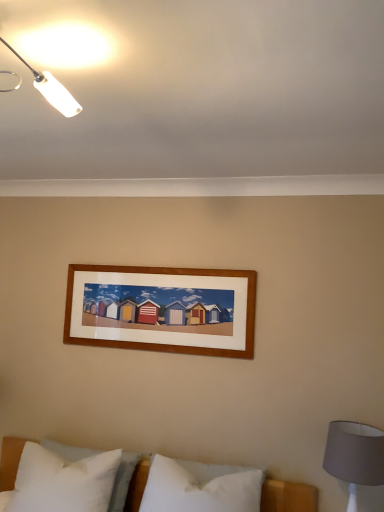
Image resolution: width=384 pixels, height=512 pixels. In order to click on free space above white plastic lamp at upper left (from a real-world perspective) in this screenshot , I will do `click(21, 34)`.